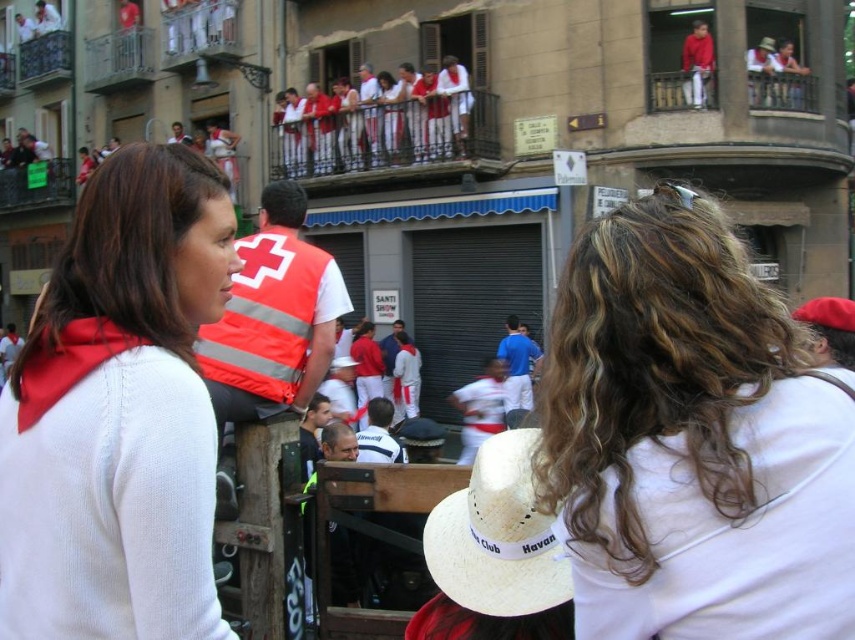
Can you confirm if white wavy hair at center is positioned to the right of white matte sweater at upper left?

Correct, you'll find white wavy hair at center to the right of white matte sweater at upper left.

Is white wavy hair at center closer to the viewer compared to white matte sweater at upper left?

No, white wavy hair at center is behind white matte sweater at upper left.

From the picture: Who is more distant from viewer, (730, 509) or (7, 589)?

Point (7, 589)

Image resolution: width=855 pixels, height=640 pixels. I want to click on white wavy hair at center, so click(x=693, y=440).

Between white wavy hair at center and white straw cowboy hat at center, which one appears on the right side from the viewer's perspective?

white wavy hair at center

Does white wavy hair at center appear under white straw cowboy hat at center?

No, white wavy hair at center is not below white straw cowboy hat at center.

Is point (803, 424) farther from camera compared to point (404, 428)?

No, it is in front of (404, 428).

Locate an element on the screen. white wavy hair at center is located at coordinates (693, 440).

Is point (180, 300) behind point (765, 36)?

No, it is not.

Between white matte sweater at upper left and white straw cowboy hat at upper center, which one appears on the left side from the viewer's perspective?

From the viewer's perspective, white matte sweater at upper left appears more on the left side.

Is point (163, 412) closer to viewer compared to point (768, 42)?

Yes, it is.

Locate an element on the screen. This screenshot has height=640, width=855. white matte sweater at upper left is located at coordinates (119, 413).